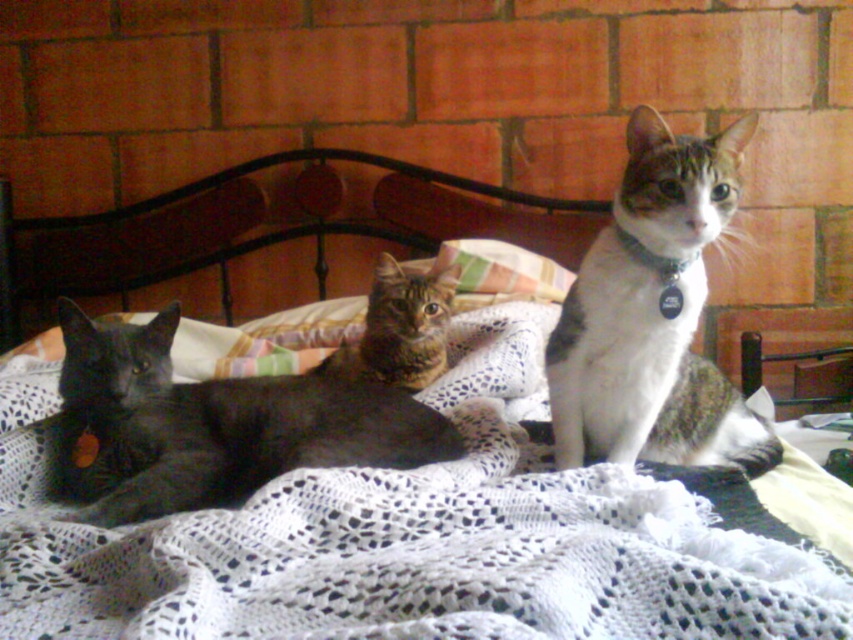
Question: Which object appears closest to the camera in this image?

Choices:
 (A) metallic black headboard at center
 (B) striped fabric pillow at center
 (C) tabby fur cat at center
 (D) white fur at center

Answer: (D)

Question: Is metallic black headboard at center smaller than tabby fur cat at center?

Choices:
 (A) yes
 (B) no

Answer: (B)

Question: Which object appears closest to the camera in this image?

Choices:
 (A) striped fabric pillow at center
 (B) shiny black cat at left
 (C) tabby fur cat at center
 (D) metallic black headboard at center

Answer: (B)

Question: Is metallic black headboard at center closer to camera compared to striped fabric pillow at center?

Choices:
 (A) yes
 (B) no

Answer: (B)

Question: Does white fur at center lie in front of striped fabric pillow at center?

Choices:
 (A) no
 (B) yes

Answer: (B)

Question: Which object is positioned farthest from the white fur at center?

Choices:
 (A) shiny black cat at left
 (B) striped fabric pillow at center
 (C) tabby fur cat at center

Answer: (B)